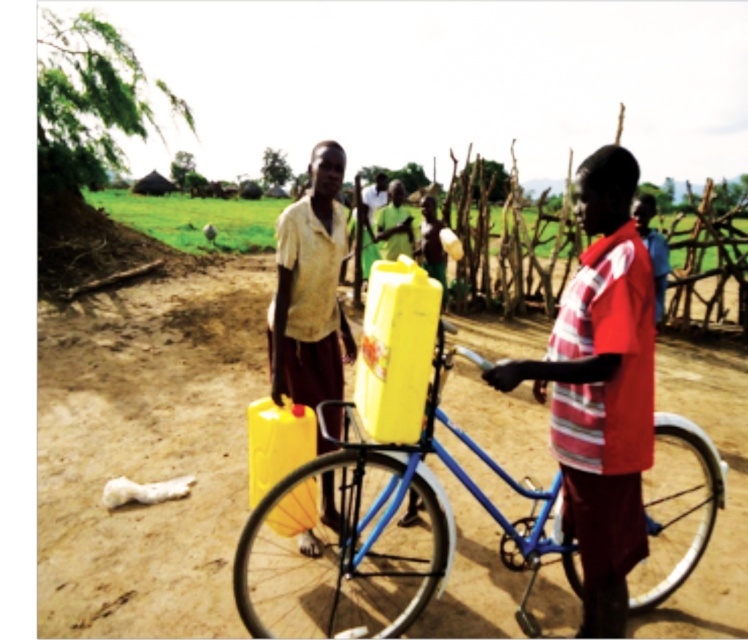
From the picture: You are a delivery person who needs to carry a 2.5 meter long ladder between the blue metallic bicycle at center and the wooden fence behind the individuals. Can you fit the ladder between them without bending it?

The distance between the blue metallic bicycle at center and the wooden fence behind the individuals is 2.60 meters. Since the ladder is 2.5 meters long, it can fit between them without bending.

You are a delivery person who needs to place a package between the matte red shirt at center and the matte yellow plastic jerrycan at center. What is the minimum length of the package so that it can fit exactly between them without overlapping?

The minimum length of the package should be 1.34 meters to fit exactly between the matte red shirt at center and the matte yellow plastic jerrycan at center without overlapping.